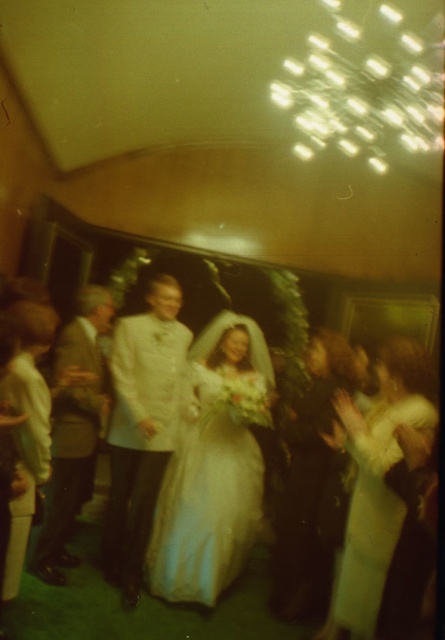
In the wedding scene, there is a point at coordinates (210, 488). What object is located at this point?

The silky white gown at center is located at point (210, 488).